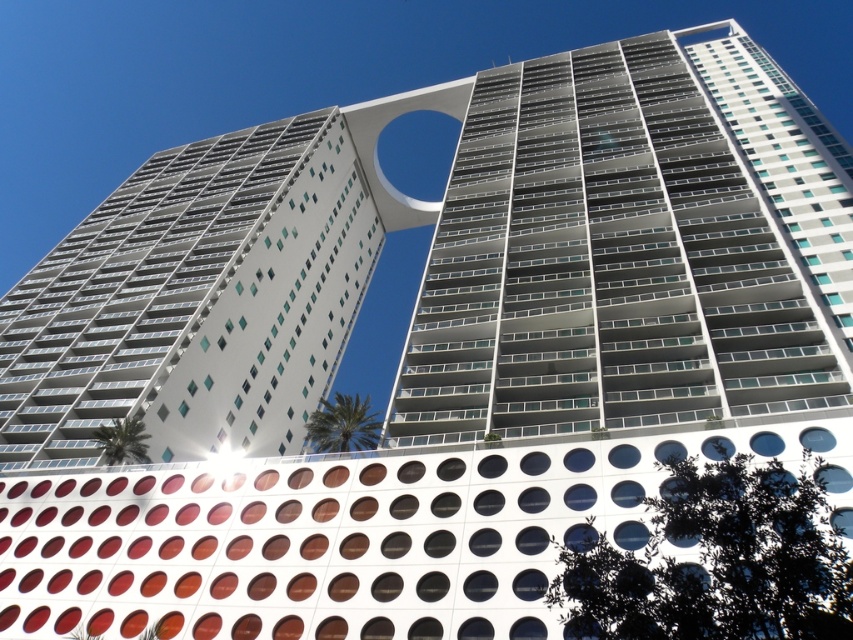
Question: Does metallic glass building at center have a greater width compared to white glass building at center?

Choices:
 (A) no
 (B) yes

Answer: (B)

Question: Observing the image, what is the correct spatial positioning of metallic glass building at center in reference to white glass building at center?

Choices:
 (A) below
 (B) above

Answer: (B)

Question: Is metallic glass building at center smaller than white glass building at center?

Choices:
 (A) yes
 (B) no

Answer: (B)

Question: Which point is farther to the camera?

Choices:
 (A) white glass building at center
 (B) metallic glass building at center

Answer: (A)

Question: Which point appears farthest from the camera in this image?

Choices:
 (A) click(x=135, y=321)
 (B) click(x=834, y=180)

Answer: (A)